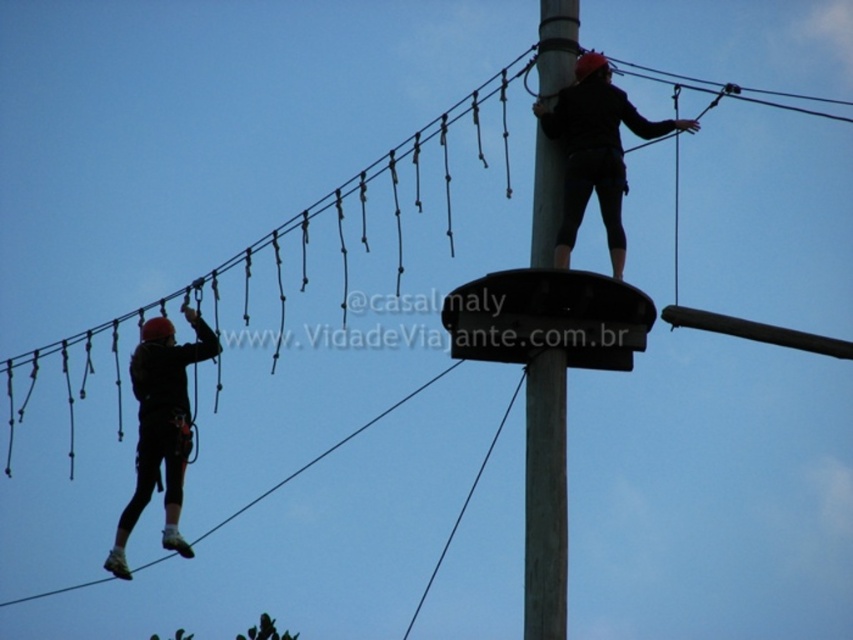
Question: Considering the relative positions of gray metallic pole at center and black matte helmet at upper center in the image provided, where is gray metallic pole at center located with respect to black matte helmet at upper center?

Choices:
 (A) left
 (B) right

Answer: (A)

Question: Does gray metallic pole at center appear on the left side of black matte helmet at upper center?

Choices:
 (A) no
 (B) yes

Answer: (B)

Question: Is gray metallic pole at center thinner than black matte helmet at upper center?

Choices:
 (A) yes
 (B) no

Answer: (A)

Question: Which of the following is the closest to the observer?

Choices:
 (A) black matte helmet at left
 (B) gray metallic pole at center

Answer: (B)

Question: Which point is farther to the camera?

Choices:
 (A) black matte helmet at left
 (B) black matte helmet at upper center

Answer: (A)

Question: Which of the following is the farthest from the observer?

Choices:
 (A) (180, 371)
 (B) (540, 593)
 (C) (585, 193)

Answer: (A)